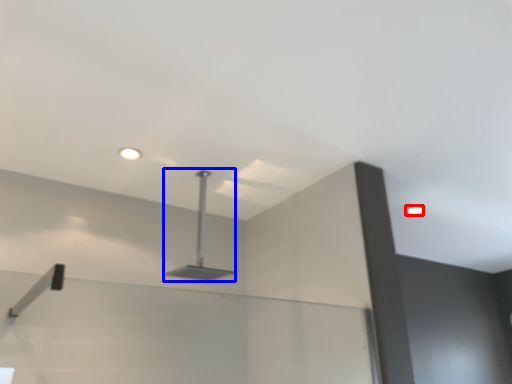
Question: Among these objects, which one is farthest to the camera, droplight (highlighted by a red box) or lamp (highlighted by a blue box)?

Choices:
 (A) droplight
 (B) lamp

Answer: (A)